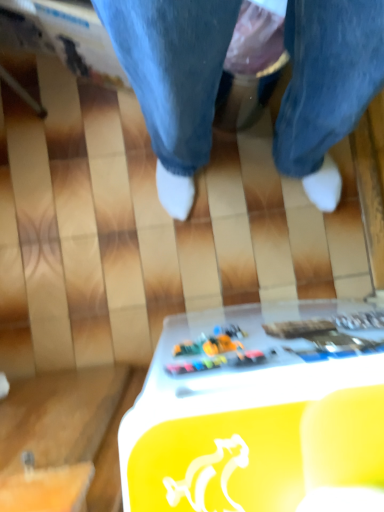
Question: Is multicolored plastic toy at center, which is the 1th writing from left to right, in front of or behind metallic gold text at lower center, which appears as the first writing when viewed from the right, in the image?

Choices:
 (A) behind
 (B) front

Answer: (B)

Question: Would you say multicolored plastic toy at center, which is the 1th writing from left to right, is to the left or to the right of metallic gold text at lower center, which is counted as the 2th writing, starting from the left, in the picture?

Choices:
 (A) left
 (B) right

Answer: (A)

Question: Based on their relative distances, which object is nearer to the metallic gold text at lower center, which appears as the first writing when viewed from the right?

Choices:
 (A) multicolored plastic toy at center, which is the 1th writing from left to right
 (B) white plastic table at lower center

Answer: (A)

Question: Which is nearer to the white plastic table at lower center?

Choices:
 (A) metallic gold text at lower center, which is counted as the 2th writing, starting from the left
 (B) multicolored plastic toy at center, which is the 1th writing from left to right

Answer: (B)